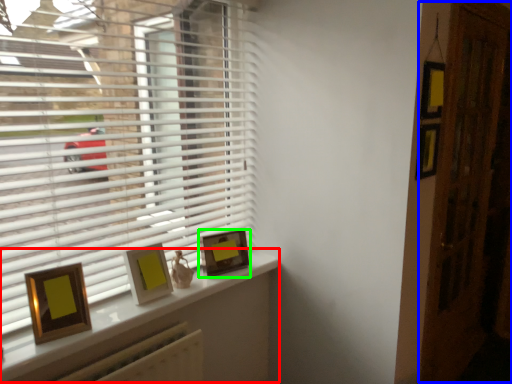
Question: Based on their relative distances, which object is nearer to window (highlighted by a red box)? Choose from screen door (highlighted by a blue box) and picture frame (highlighted by a green box).

Choices:
 (A) screen door
 (B) picture frame

Answer: (B)